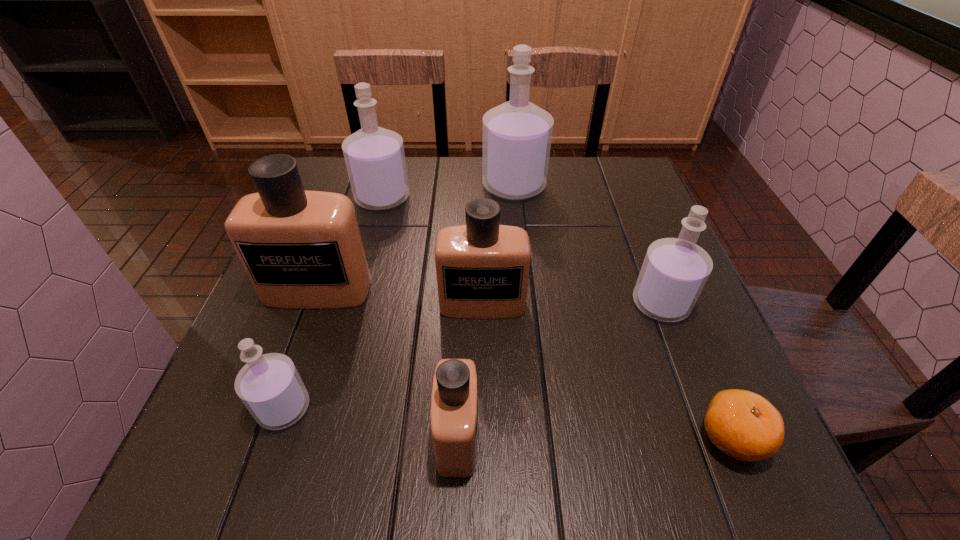
This screenshot has width=960, height=540. Find the location of `purple perfume object that ranks as the closest to the biggest purple perfume`. purple perfume object that ranks as the closest to the biggest purple perfume is located at coordinates (374, 156).

Select which beige perfume is the third closest to the second biggest purple perfume. Please provide its 2D coordinates. Your answer should be formatted as a tuple, i.e. [(x, y)], where the tuple contains the x and y coordinates of a point satisfying the conditions above.

[(454, 401)]

Locate an element on the screen. the second closest beige perfume relative to the smallest beige perfume is located at coordinates (301, 249).

Where is `free spot that satisfies the following two spatial constraints: 1. on the front side of the smallest purple perfume; 2. on the left side of the shortest object`? Image resolution: width=960 pixels, height=540 pixels. free spot that satisfies the following two spatial constraints: 1. on the front side of the smallest purple perfume; 2. on the left side of the shortest object is located at coordinates 274,437.

Locate an element on the screen. This screenshot has height=540, width=960. free space that satisfies the following two spatial constraints: 1. on the front label of the second biggest beige perfume; 2. on the front label of the smallest beige perfume is located at coordinates (483, 436).

The height and width of the screenshot is (540, 960). I want to click on vacant space that satisfies the following two spatial constraints: 1. on the back side of the smallest purple perfume; 2. on the left side of the rightmost perfume, so click(x=320, y=303).